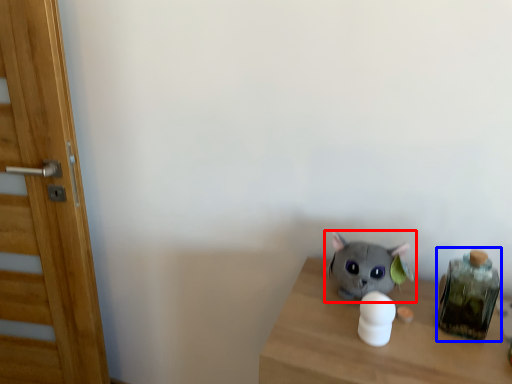
Question: Which object appears farthest to the camera in this image, toy (highlighted by a red box) or glass jar (highlighted by a blue box)?

Choices:
 (A) toy
 (B) glass jar

Answer: (A)